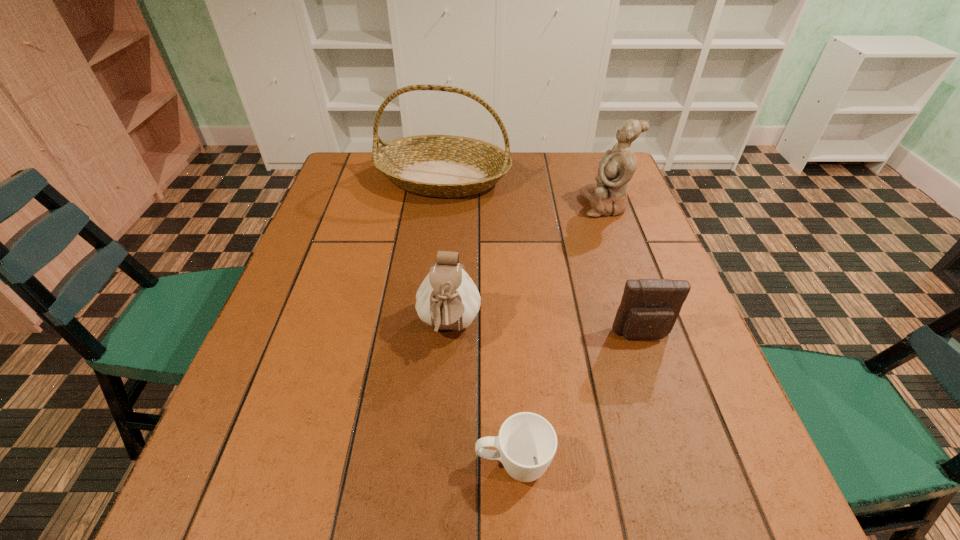
Where is `basket`? basket is located at coordinates (445, 166).

This screenshot has height=540, width=960. In order to click on figurine in this screenshot , I will do `click(608, 196)`.

Identify the location of the third tallest object. Image resolution: width=960 pixels, height=540 pixels. point(447,299).

Find the location of a particular element. This screenshot has width=960, height=540. the left pouch is located at coordinates (447, 299).

Where is `the right pouch`? Image resolution: width=960 pixels, height=540 pixels. the right pouch is located at coordinates (649, 308).

At what (x,y) coordinates should I click in order to perform the action: click on the shorter pouch. Please return your answer as a coordinate pair (x, y). This screenshot has height=540, width=960. Looking at the image, I should click on (649, 308).

Locate an element on the screen. The height and width of the screenshot is (540, 960). the nearest object is located at coordinates [x=527, y=442].

Locate an element on the screen. cup is located at coordinates (527, 442).

The image size is (960, 540). What are the coordinates of `free location located on the right of the basket` in the screenshot? It's located at (592, 178).

At what (x,y) coordinates should I click in order to perform the action: click on free space located on the front-facing side of the figurine. Please return your answer as a coordinate pair (x, y). This screenshot has width=960, height=540. Looking at the image, I should click on (537, 205).